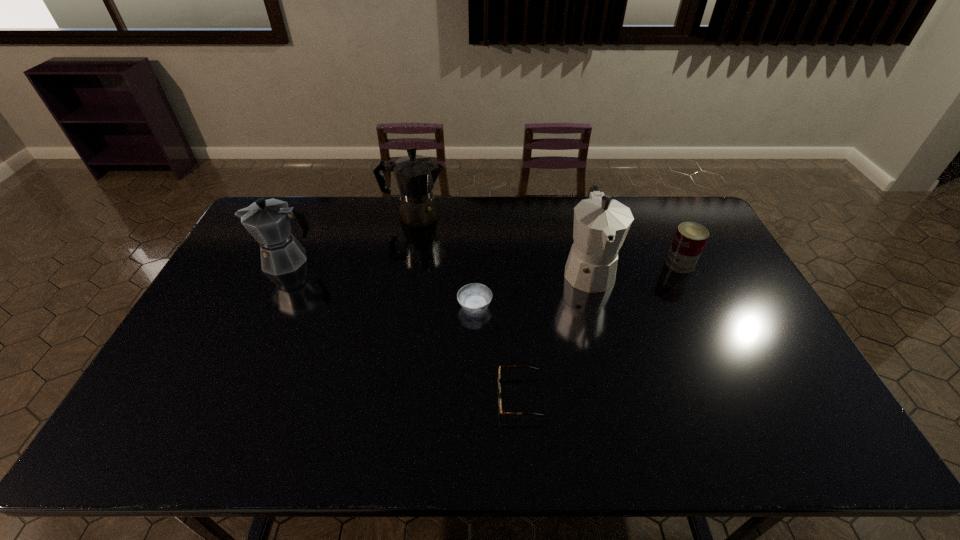
Locate an element on the screen. The image size is (960, 540). vacant region located 0.090m at the spout of the rightmost coffeepot is located at coordinates (602, 324).

The width and height of the screenshot is (960, 540). Find the location of `free space located on the pouring side of the second coffeepot from right to left`. free space located on the pouring side of the second coffeepot from right to left is located at coordinates (555, 216).

The width and height of the screenshot is (960, 540). Find the location of `free spot located 0.300m on the front label of the can`. free spot located 0.300m on the front label of the can is located at coordinates (575, 264).

I want to click on vacant region located 0.380m on the front label of the can, so click(x=550, y=264).

Where is `free spot located 0.130m on the front label of the can`? This screenshot has height=540, width=960. free spot located 0.130m on the front label of the can is located at coordinates (627, 264).

This screenshot has height=540, width=960. In order to click on vacant space located on the back of the ashtray in this screenshot , I will do `click(475, 267)`.

You are a GUI agent. You are given a task and a screenshot of the screen. Output one action in this format:
    pyautogui.click(x=<x>, y=<y>)
    Task: Click on the vacant region located 0.200m on the frame of the nearest object
    The width and height of the screenshot is (960, 540).
    Given the screenshot: What is the action you would take?
    pyautogui.click(x=418, y=396)

At what (x,y) coordinates should I click in order to perform the action: click on blank space located 0.370m on the frame of the nearest object. Please return your answer as a coordinate pair (x, y). Looking at the image, I should click on (349, 396).

This screenshot has width=960, height=540. I want to click on vacant space located 0.100m on the frame of the nearest object, so click(458, 396).

Locate an element on the screen. This screenshot has width=960, height=540. object present at the far edge is located at coordinates point(415,175).